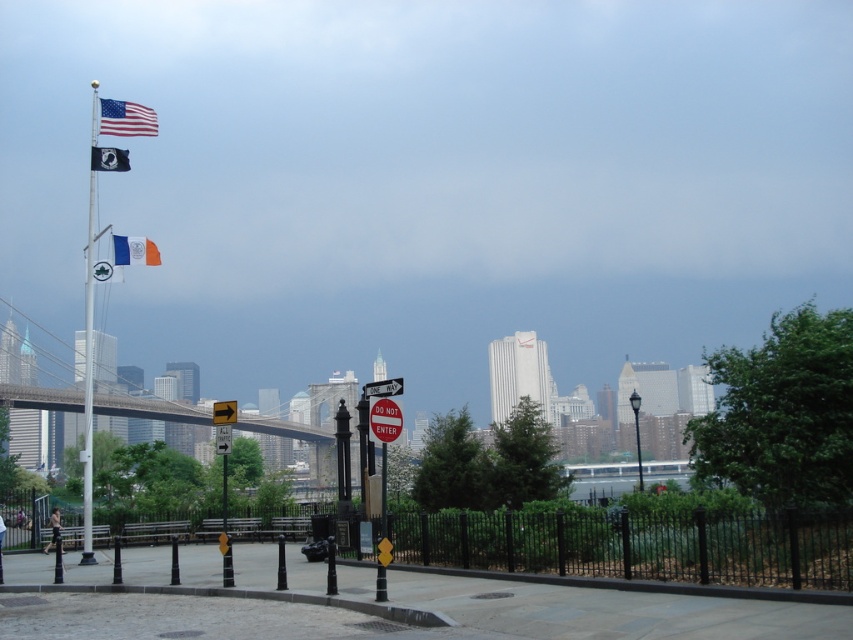
This screenshot has width=853, height=640. What are the coordinates of `white metallic flag pole at left` in the screenshot? It's located at [x=88, y=380].

The width and height of the screenshot is (853, 640). What do you see at coordinates (88, 380) in the screenshot?
I see `white metallic flag pole at left` at bounding box center [88, 380].

The height and width of the screenshot is (640, 853). What are the coordinates of `white metallic flag pole at left` in the screenshot? It's located at (88, 380).

Is point (103, 116) behind point (229, 451)?

Yes, it is behind point (229, 451).

Identify the location of matte fabric flag at upper left. This screenshot has width=853, height=640. (126, 118).

The image size is (853, 640). What do you see at coordinates (126, 118) in the screenshot?
I see `matte fabric flag at upper left` at bounding box center [126, 118].

Identify the location of matte fabric flag at upper left. (126, 118).

Who is more forward, (96, 120) or (143, 246)?

Point (96, 120)

Does white metallic flag pole at left have a greater width compared to blue fabric flag at upper left?

Yes, white metallic flag pole at left is wider than blue fabric flag at upper left.

Does point (90, 470) come behind point (146, 262)?

No, it is not.

Find the location of a particular element. white metallic flag pole at left is located at coordinates (88, 380).